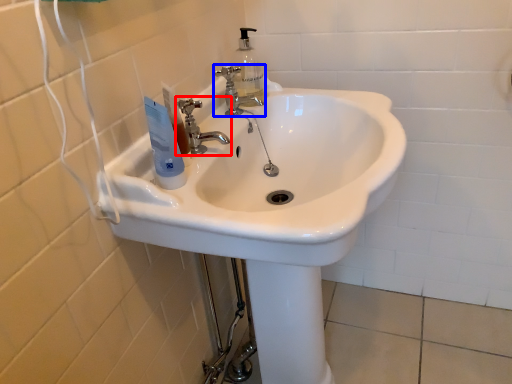
Question: Which object appears farthest to the camera in this image, tap (highlighted by a red box) or tap (highlighted by a blue box)?

Choices:
 (A) tap
 (B) tap

Answer: (B)